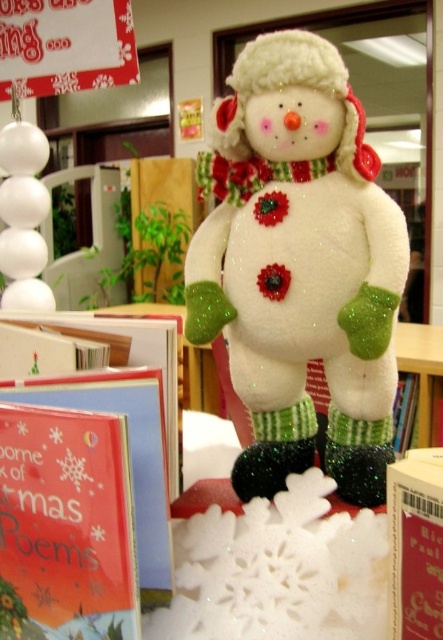
Question: Which point is closer to the camera taking this photo?

Choices:
 (A) (423, 452)
 (B) (162, 465)
 (C) (376, 164)
 (D) (325, 621)

Answer: (A)

Question: Is matte red card at center smaller than white paper book at center?

Choices:
 (A) no
 (B) yes

Answer: (A)

Question: Can you confirm if matte red card at center is positioned below white paper book at center?

Choices:
 (A) yes
 (B) no

Answer: (B)

Question: Estimate the real-world distances between objects in this image. Which object is farther from the matte red card at center?

Choices:
 (A) white paper book at center
 (B) fuzzy white snowman at center

Answer: (A)

Question: Is white glittery snowflake at lower center bigger than white paper book at center?

Choices:
 (A) no
 (B) yes

Answer: (B)

Question: Based on their relative distances, which object is nearer to the white paper book at center?

Choices:
 (A) fuzzy white snowman at center
 (B) white glittery snowflake at lower center

Answer: (B)